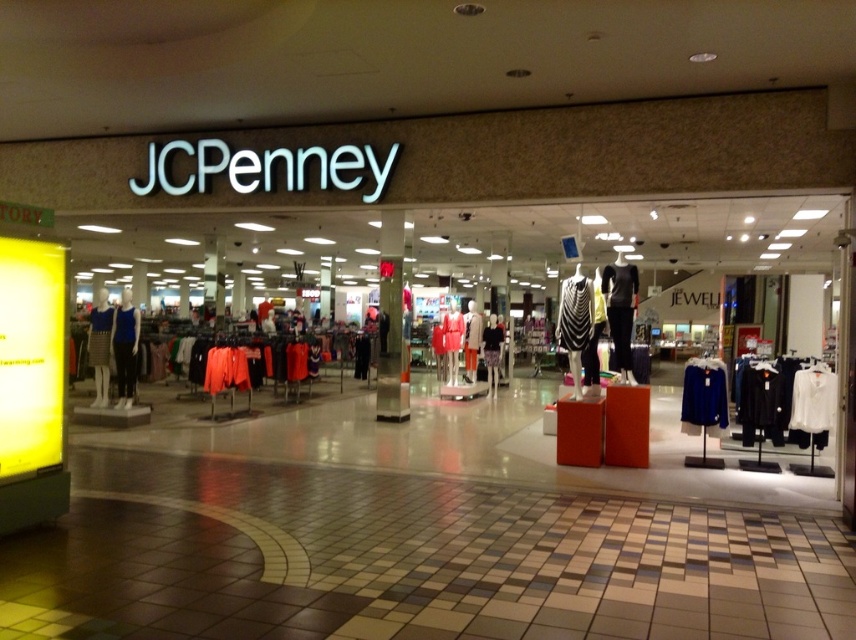
Question: Estimate the real-world distances between objects in this image. Which object is farther from the black matte dress at center?

Choices:
 (A) matte blue dress at left
 (B) white matte shirt at center
 (C) striped fabric dress at center
 (D) matte black dress at center

Answer: (A)

Question: Can you confirm if matte black dress at center is positioned to the left of striped fabric dress at center?

Choices:
 (A) yes
 (B) no

Answer: (A)

Question: Is blue fabric coat at center positioned in front of black matte dress at center?

Choices:
 (A) no
 (B) yes

Answer: (A)

Question: Which of the following is the closest to the observer?

Choices:
 (A) (132, 380)
 (B) (693, 419)

Answer: (B)

Question: Which of the following is the closest to the observer?

Choices:
 (A) blue fabric coat at center
 (B) black matte dress at center
 (C) striped fabric dress at center

Answer: (B)

Question: Can you confirm if black matte dress at center is positioned to the left of striped fabric dress at center?

Choices:
 (A) no
 (B) yes

Answer: (A)